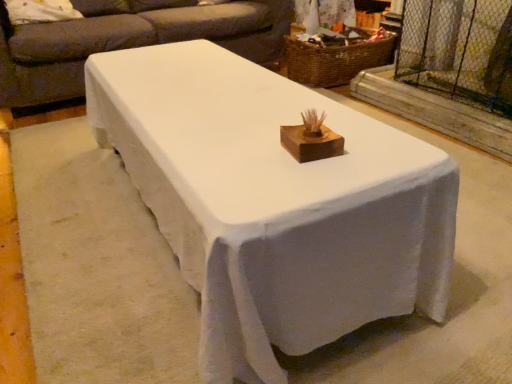
Question: Considering the positions of point (260, 319) and point (307, 84), is point (260, 319) closer or farther from the camera than point (307, 84)?

Choices:
 (A) closer
 (B) farther

Answer: (A)

Question: Is white painted wood table at center taller or shorter than woven brown basket at upper center?

Choices:
 (A) short
 (B) tall

Answer: (A)

Question: Estimate the real-world distances between objects in this image. Which object is closer to the matte gray couch at upper center?

Choices:
 (A) white painted wood table at center
 (B) wooden at center
 (C) woven brown basket at upper center
 (D) clear plastic screen door at upper right

Answer: (C)

Question: Estimate the real-world distances between objects in this image. Which object is closer to the white painted wood table at center?

Choices:
 (A) matte gray couch at upper center
 (B) woven brown basket at upper center
 (C) clear plastic screen door at upper right
 (D) wooden at center

Answer: (D)